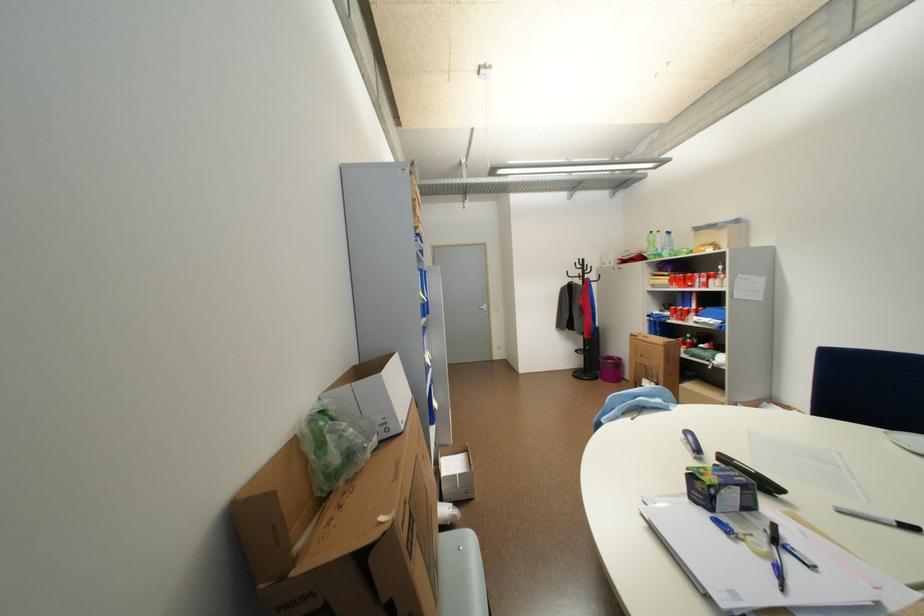
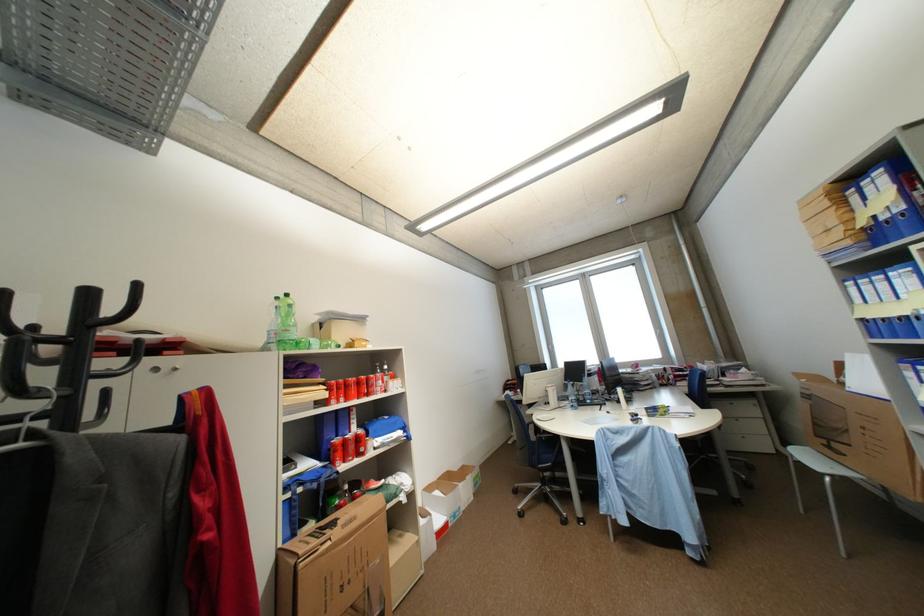
Where in the second image is the point corresponding to (x=691, y=315) from the first image?

(368, 447)